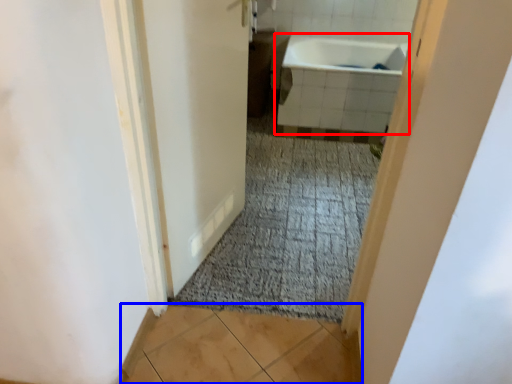
Question: Which point is further to the camera, bathtub (highlighted by a red box) or tile (highlighted by a blue box)?

Choices:
 (A) bathtub
 (B) tile

Answer: (A)